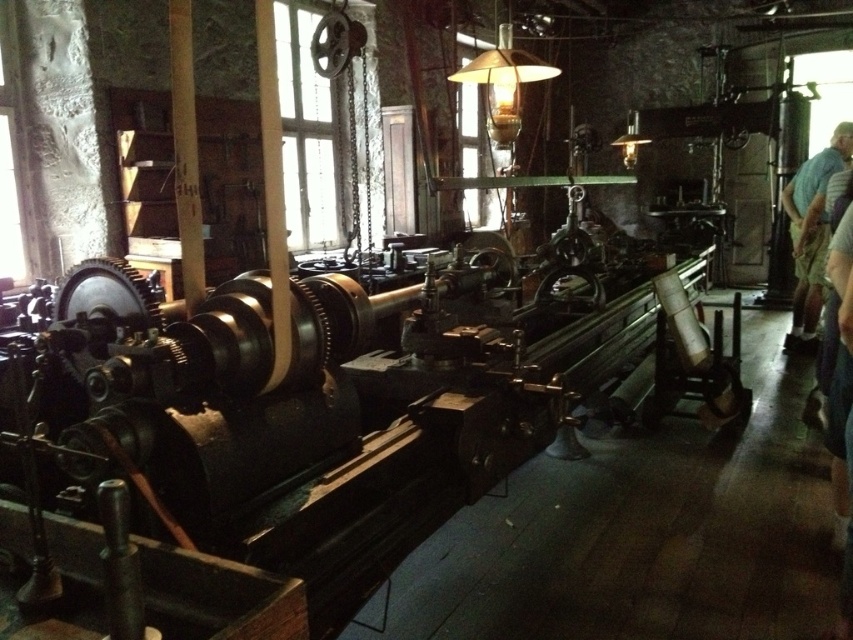
Question: Where is blue shirt at right located in relation to matte glass lampshade at upper center in the image?

Choices:
 (A) left
 (B) right

Answer: (B)

Question: Is blue shirt at right above matte glass lampshade at upper center?

Choices:
 (A) no
 (B) yes

Answer: (A)

Question: Observing the image, what is the correct spatial positioning of blue shirt at right in reference to matte glass lampshade at upper center?

Choices:
 (A) below
 (B) above

Answer: (A)

Question: Among these points, which one is nearest to the camera?

Choices:
 (A) (816, 292)
 (B) (494, 102)

Answer: (B)